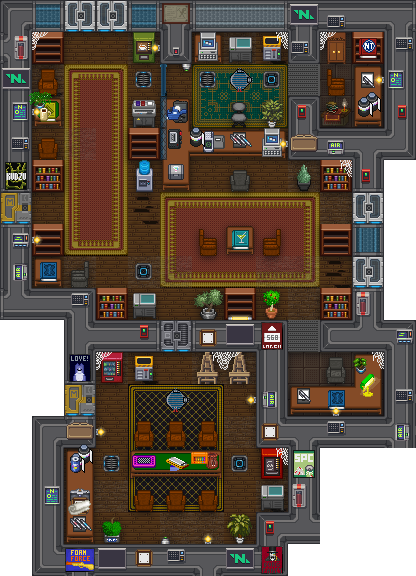
Find the location of `bookshelf`. bookshelf is located at coordinates tap(335, 306), tap(106, 301), tap(42, 178), tap(53, 44), tap(148, 135), tap(331, 234), tap(334, 179).